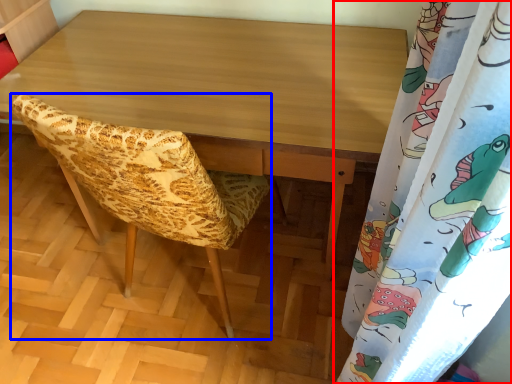
Question: Which point is closer to the camera, curtain (highlighted by a red box) or furniture (highlighted by a blue box)?

Choices:
 (A) curtain
 (B) furniture

Answer: (A)